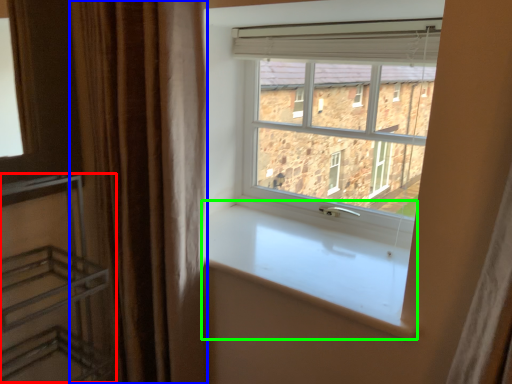
Question: Which is nearer to the shelf (highlighted by a red box)? curtain (highlighted by a blue box) or window sill (highlighted by a green box).

Choices:
 (A) curtain
 (B) window sill

Answer: (A)